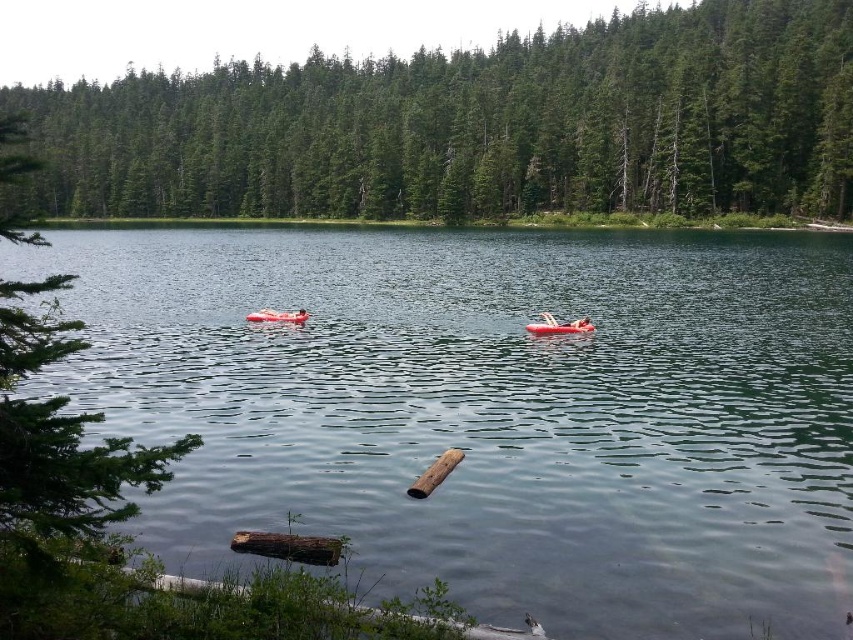
Question: Where is brown rough log at lower center located in relation to orange rubber boat at center in the image?

Choices:
 (A) above
 (B) below

Answer: (B)

Question: Which of these objects is positioned farthest from the rubber red boat at center?

Choices:
 (A) brown wood log at center
 (B) orange rubber boat at center
 (C) green matte tree at center

Answer: (C)

Question: Is clear water at center bigger than brown wood log at center?

Choices:
 (A) no
 (B) yes

Answer: (B)

Question: Does green matte tree at center appear on the right side of orange rubber boat at center?

Choices:
 (A) no
 (B) yes

Answer: (A)

Question: Among these points, which one is farthest from the camera?

Choices:
 (A) (567, 332)
 (B) (294, 314)
 (C) (779, 394)

Answer: (B)

Question: Considering the real-world distances, which object is farthest from the clear water at center?

Choices:
 (A) orange rubber boat at center
 (B) rubber red boat at center
 (C) brown rough log at lower center
 (D) brown wood log at center

Answer: (D)